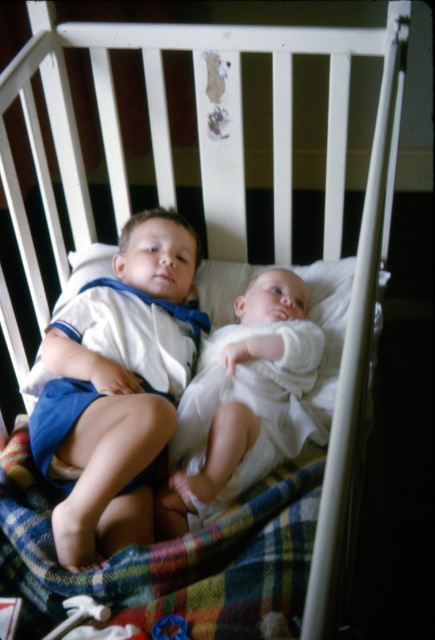
You are a photographer taking a picture of the two children in the crib. You notice two points marked in the image. Which point, point (250, 572) or point (197, 397), is closer to you?

Point (250, 572) is closer to the viewer than point (197, 397).

You are a parent trying to place a new stuffed animal in the crib. The plaid fabric at center and the white soft baby at center are already there. Which object can you place the stuffed animal next to without it being covered?

The plaid fabric at center has a larger size compared to white soft baby at center, so the stuffed animal can be placed next to the plaid fabric at center as it has more space available.